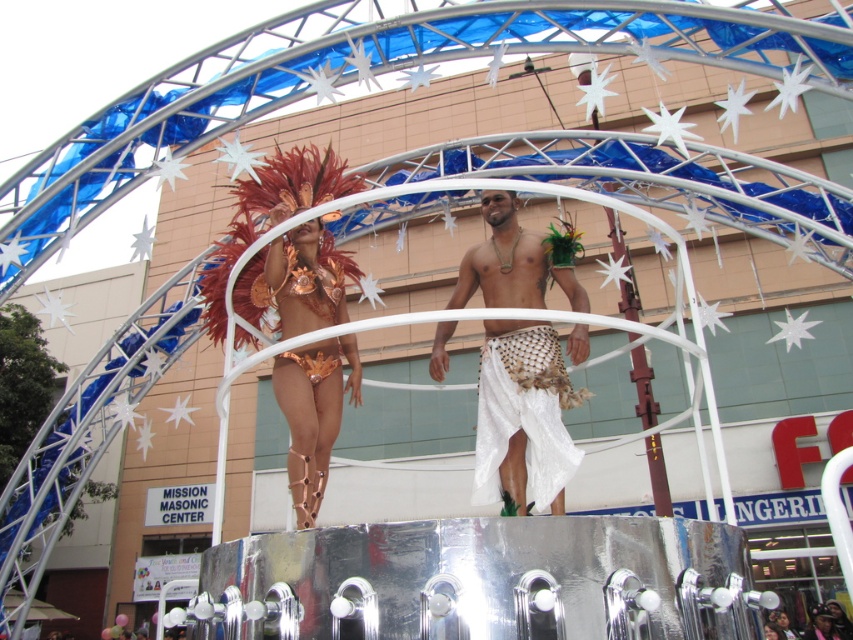
Can you confirm if copper metallic bikini at center is smaller than metallic gold bikini at center?

Actually, copper metallic bikini at center might be larger than metallic gold bikini at center.

Is copper metallic bikini at center above metallic gold bikini at center?

Correct, copper metallic bikini at center is located above metallic gold bikini at center.

I want to click on copper metallic bikini at center, so click(312, 413).

In order to click on copper metallic bikini at center in this screenshot , I will do `click(312, 413)`.

What do you see at coordinates (524, 413) in the screenshot? I see `white woven skirt at center` at bounding box center [524, 413].

Who is higher up, white woven skirt at center or metallic gold bikini at center?

metallic gold bikini at center is above.

What do you see at coordinates (524, 413) in the screenshot?
I see `white woven skirt at center` at bounding box center [524, 413].

The image size is (853, 640). Find the location of `white woven skirt at center`. white woven skirt at center is located at coordinates (524, 413).

Can you confirm if white woven cloth at center is positioned above metallic gold bikini at center?

Incorrect, white woven cloth at center is not positioned above metallic gold bikini at center.

Consider the image. Which is more to the right, white woven cloth at center or metallic gold bikini at center?

white woven cloth at center is more to the right.

Which is behind, point (506, 353) or point (299, 356)?

Positioned behind is point (299, 356).

Find the location of a particular element. The height and width of the screenshot is (640, 853). white woven cloth at center is located at coordinates (523, 417).